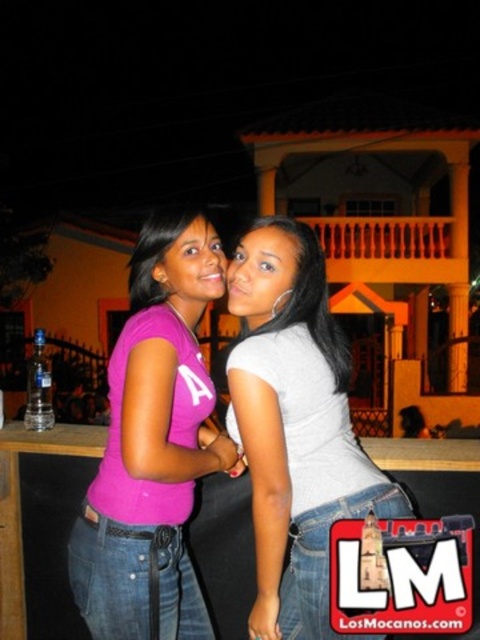
Can you confirm if matte pink t-shirt at center is wider than gray matte shirt at center?

Incorrect, matte pink t-shirt at center's width does not surpass gray matte shirt at center's.

Based on the photo, can you confirm if matte pink t-shirt at center is positioned to the right of gray matte shirt at center?

In fact, matte pink t-shirt at center is to the left of gray matte shirt at center.

Is point (116, 508) closer to viewer compared to point (255, 516)?

No, it is not.

The height and width of the screenshot is (640, 480). What are the coordinates of `matte pink t-shirt at center` in the screenshot? It's located at (154, 444).